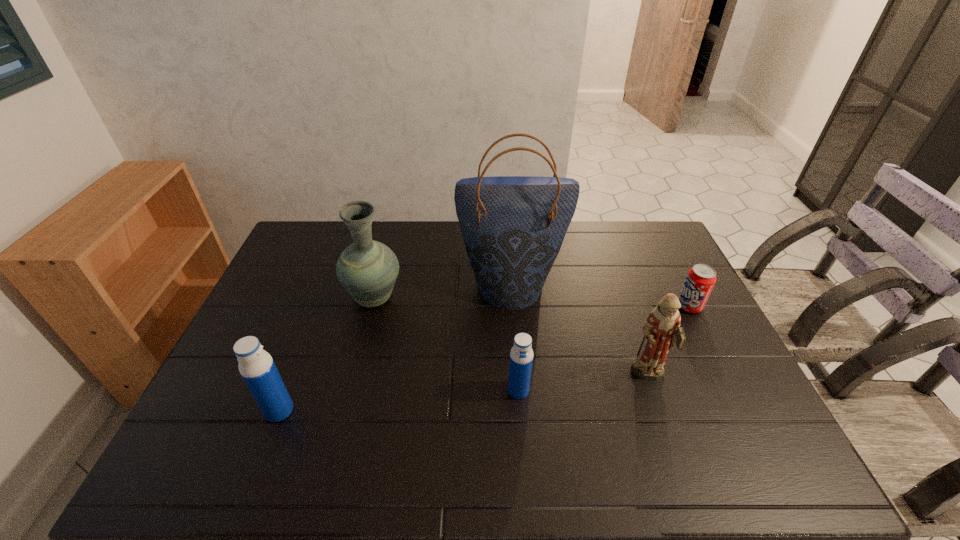
At what (x,y) coordinates should I click in order to perform the action: click on object positioned at the near edge. Please return your answer as a coordinate pair (x, y). This screenshot has width=960, height=540. Looking at the image, I should click on (256, 366).

Image resolution: width=960 pixels, height=540 pixels. I want to click on object at the left edge, so click(256, 366).

At what (x,y) coordinates should I click in order to perform the action: click on object located in the right edge section of the desktop. Please return your answer as a coordinate pair (x, y). The height and width of the screenshot is (540, 960). Looking at the image, I should click on (700, 280).

This screenshot has height=540, width=960. Find the location of `object positioned at the near left corner`. object positioned at the near left corner is located at coordinates (256, 366).

The width and height of the screenshot is (960, 540). I want to click on free spot at the far edge of the desktop, so (x=460, y=251).

In the image, there is a desktop. At what (x,y) coordinates should I click in order to perform the action: click on vacant space at the left edge. Please return your answer as a coordinate pair (x, y). Image resolution: width=960 pixels, height=540 pixels. Looking at the image, I should click on (301, 315).

Find the location of a particular element. This screenshot has height=540, width=960. vacant space at the far left corner of the desktop is located at coordinates (306, 223).

In the image, there is a desktop. At what (x,y) coordinates should I click in order to perform the action: click on vacant space at the far right corner. Please return your answer as a coordinate pair (x, y). Looking at the image, I should click on (664, 238).

Image resolution: width=960 pixels, height=540 pixels. What are the coordinates of `free region at the near right corner of the desktop` in the screenshot? It's located at (744, 421).

Locate an element on the screen. vacant space that's between the fifth object from left to right and the pitcher is located at coordinates (512, 338).